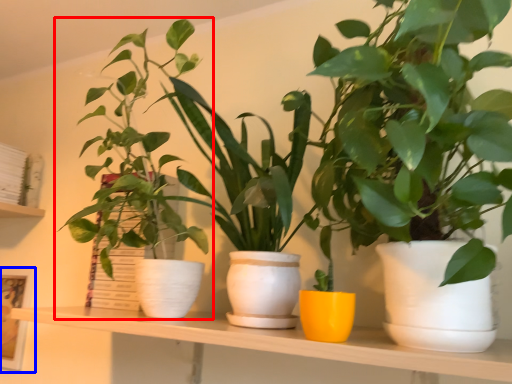
Question: Which point is further to the camera, houseplant (highlighted by a red box) or picture frame (highlighted by a blue box)?

Choices:
 (A) houseplant
 (B) picture frame

Answer: (B)